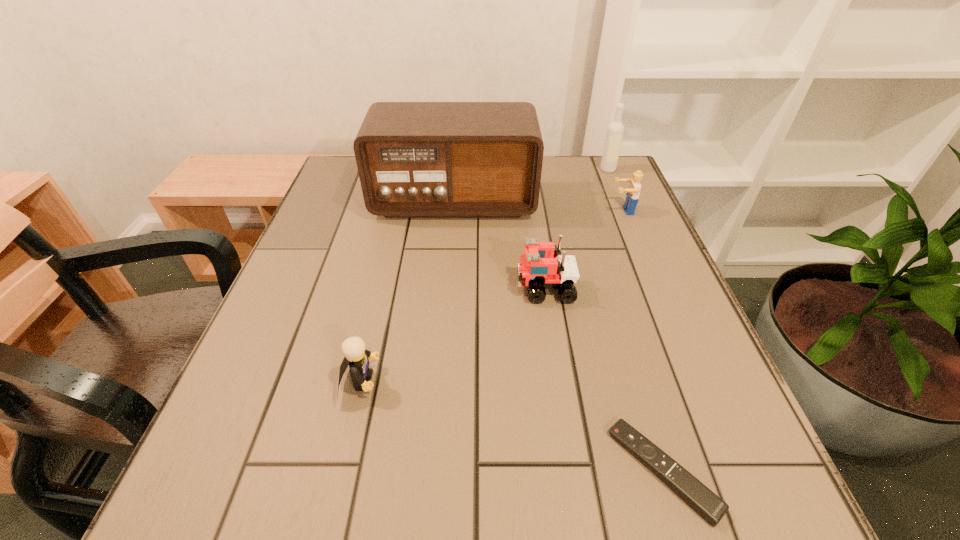
You are a GUI agent. You are given a task and a screenshot of the screen. Output one action in this format:
    pyautogui.click(x=<x>, y=<y>)
    Task: Click on the free space located 0.140m on the front-facing side of the radio receiver
    This screenshot has height=540, width=960.
    Given the screenshot: What is the action you would take?
    point(449,258)

In order to click on free spot located 0.340m on the front of the second tallest object in this screenshot , I will do `click(640, 248)`.

Identify the location of vacant region located 0.170m on the front-facing side of the third nearest object. (436, 288).

Locate an element on the screen. This screenshot has height=540, width=960. free spot located on the front-facing side of the third nearest object is located at coordinates (421, 288).

Locate an element on the screen. blank area located on the front-facing side of the third nearest object is located at coordinates (450, 288).

The image size is (960, 540). Find the location of `blank space located 0.280m on the face of the farthest Lego`. blank space located 0.280m on the face of the farthest Lego is located at coordinates (501, 211).

The width and height of the screenshot is (960, 540). I want to click on free space located 0.370m on the face of the farthest Lego, so click(x=467, y=211).

You are a GUI agent. You are given a task and a screenshot of the screen. Output one action in this format:
    pyautogui.click(x=<x>, y=<y>)
    Task: Click on the free space located on the face of the farthest Lego
    The image size is (960, 540).
    Given the screenshot: What is the action you would take?
    pyautogui.click(x=490, y=211)

Identify the location of free spot located on the front-facing side of the fifth farthest object. Image resolution: width=960 pixels, height=540 pixels. (554, 381).

Locate an element on the screen. Image resolution: width=960 pixels, height=540 pixels. free space located 0.050m on the right of the shortest object is located at coordinates point(744,470).